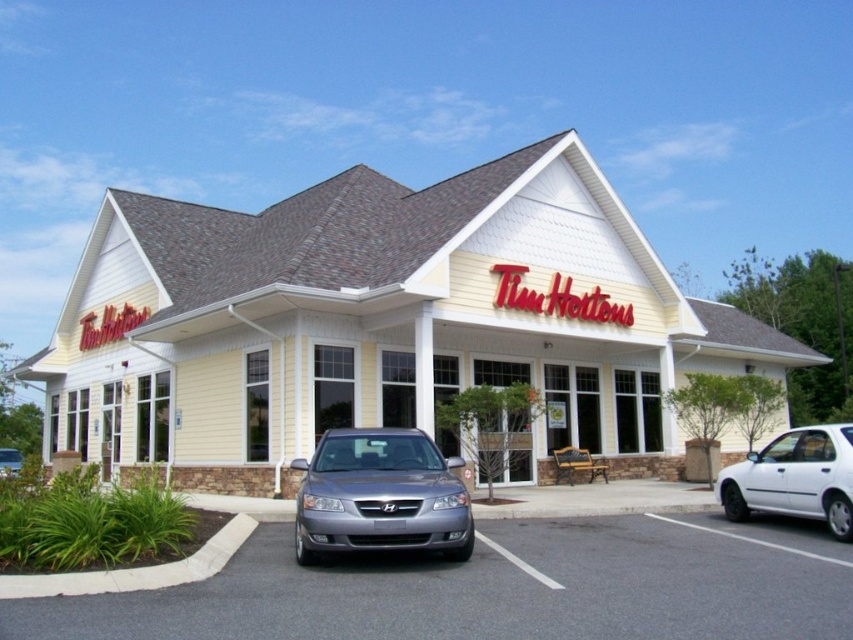
You are a customer standing at the entrance of the Tim Hortons restaurant. You want to know if the yellow siding at center is wider than the gray asphalt parking lot at center. Can you determine this based on the scene?

The yellow siding at center might be wider than gray asphalt parking lot at center, but the scene description does not provide specific measurements or comparative details between the two objects. Therefore, it is not possible to definitively determine which is wider based on the given information.

You are driving a car and approaching the Tim Hortons entrance. You see the yellow siding at center and the white matte car at lower right. Which object is closer to you as you approach the entrance?

The yellow siding at center is closer to you than the white matte car at lower right because it is further to the viewer.

You are standing at the entrance of the Tim Hortons restaurant. You see the yellow siding at center and the gray asphalt parking lot at center. Which of these two objects is closer to you?

The yellow siding at center is closer to you since it is further to the viewer than the gray asphalt parking lot at center, meaning it appears nearer in the visual perspective.